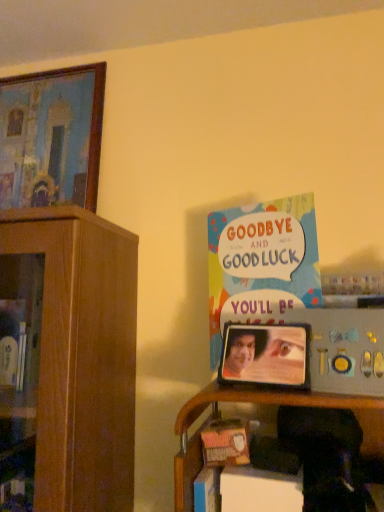
Question: From a real-world perspective, is wooden painted picture frame at upper left, marked as the 2th picture frame in a right-to-left arrangement, positioned above or below wooden shelf at lower right?

Choices:
 (A) below
 (B) above

Answer: (B)

Question: Is wooden painted picture frame at upper left, which ranks as the 1th picture frame in back-to-front order, spatially inside wooden shelf at lower right, or outside of it?

Choices:
 (A) outside
 (B) inside

Answer: (A)

Question: Considering the real-world distances, which object is farthest from the wooden painted picture frame at upper left, which is the second picture frame in bottom-to-top order?

Choices:
 (A) wooden shelf at lower right
 (B) multicolored paper card at upper right
 (C) metallic silver picture frame at center, the second picture frame viewed from the left

Answer: (A)

Question: Which object is the closest to the multicolored paper card at upper right?

Choices:
 (A) metallic silver picture frame at center, which appears as the second picture frame when viewed from the back
 (B) wooden painted picture frame at upper left, which is the second picture frame in bottom-to-top order
 (C) wooden shelf at lower right

Answer: (A)